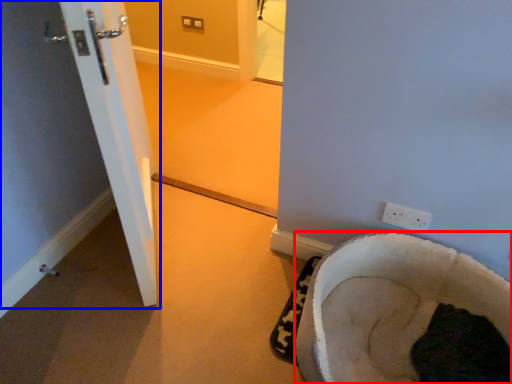
Question: Which of the following is the closest to the observer, furniture (highlighted by a red box) or door (highlighted by a blue box)?

Choices:
 (A) furniture
 (B) door

Answer: (A)